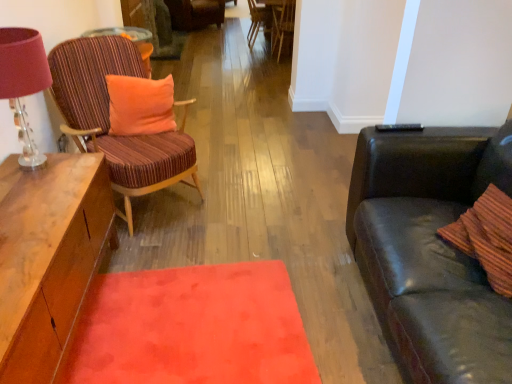
At what (x,y) coordinates should I click in order to perform the action: click on free space above velvety orange mat at center (from a real-world perspective). Please return your answer as a coordinate pair (x, y). This screenshot has height=384, width=512. Looking at the image, I should click on (186, 326).